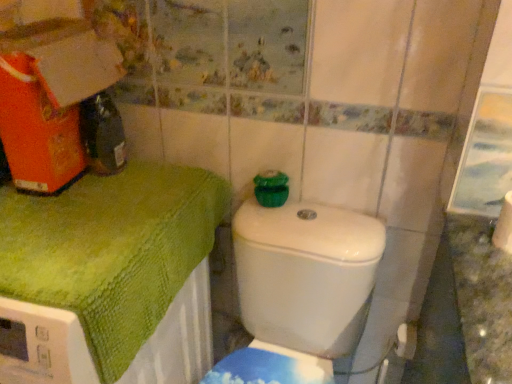
What is the approximate width of white glossy toilet at center?

25.74 inches.

Locate an element on the screen. Image resolution: width=512 pixels, height=384 pixels. white glossy toilet at center is located at coordinates (305, 275).

Does point (279, 326) appear closer or farther from the camera than point (510, 224)?

Point (279, 326) is farther from the camera than point (510, 224).

How many degrees apart are the facing directions of white glossy toilet at center and white matte toilet paper at lower right, the second toilet paper from the back?

white glossy toilet at center and white matte toilet paper at lower right, the second toilet paper from the back, are facing 88.5 degrees away from each other.

Does white glossy toilet at center have a lesser height compared to white matte toilet paper at lower right, the 1th toilet paper from the top?

No, white glossy toilet at center is not shorter than white matte toilet paper at lower right, the 1th toilet paper from the top.

Are white glossy toilet at center and white matte toilet paper at lower right, marked as the second toilet paper in a bottom-to-top arrangement, making contact?

No, white glossy toilet at center is not beside white matte toilet paper at lower right, marked as the second toilet paper in a bottom-to-top arrangement.

From the image's perspective, is white matte toilet paper at lower right, which is the 1th toilet paper in back-to-front order, above or below green textured towel at upper left?

white matte toilet paper at lower right, which is the 1th toilet paper in back-to-front order, is below green textured towel at upper left.

Considering the sizes of objects white matte toilet paper at lower right, which is the 1th toilet paper in back-to-front order, and green textured towel at upper left in the image provided, who is smaller, white matte toilet paper at lower right, which is the 1th toilet paper in back-to-front order, or green textured towel at upper left?

white matte toilet paper at lower right, which is the 1th toilet paper in back-to-front order.

Based on the photo, how many degrees apart are the facing directions of white matte toilet paper at lower right, which is the 1th toilet paper in back-to-front order, and green textured towel at upper left?

The angle between the facing direction of white matte toilet paper at lower right, which is the 1th toilet paper in back-to-front order, and the facing direction of green textured towel at upper left is 3.38 degrees.

Which object is further away from the camera, white matte toilet paper at lower right, which ranks as the second toilet paper in top-to-bottom order, or green textured towel at upper left?

white matte toilet paper at lower right, which ranks as the second toilet paper in top-to-bottom order, is behind.

Based on their sizes in the image, would you say green textured towel at upper left is bigger or smaller than white glossy toilet at center?

Considering their sizes, green textured towel at upper left takes up more space than white glossy toilet at center.

Is green textured towel at upper left located outside white glossy toilet at center?

Yes, green textured towel at upper left is located beyond the bounds of white glossy toilet at center.

Does green textured towel at upper left appear on the left side of white glossy toilet at center?

Yes, green textured towel at upper left is to the left of white glossy toilet at center.

Is the surface of green textured towel at upper left in direct contact with white glossy toilet at center?

No, green textured towel at upper left is not beside white glossy toilet at center.

From the image's perspective, is white glossy toilet at center positioned above or below white matte toilet paper at lower right, placed as the 1th toilet paper when sorted from bottom to top?

From the image's perspective, white glossy toilet at center appears below white matte toilet paper at lower right, placed as the 1th toilet paper when sorted from bottom to top.

From a real-world perspective, is white glossy toilet at center above or below white matte toilet paper at lower right, which is the 1th toilet paper in back-to-front order?

white glossy toilet at center is above white matte toilet paper at lower right, which is the 1th toilet paper in back-to-front order.

Is white glossy toilet at center taller than white matte toilet paper at lower right, which ranks as the second toilet paper in top-to-bottom order?

Indeed, white glossy toilet at center has a greater height compared to white matte toilet paper at lower right, which ranks as the second toilet paper in top-to-bottom order.

Is green textured towel at upper left thinner than white matte toilet paper at lower right, which is the 1th toilet paper in back-to-front order?

No.

From the image's perspective, is green textured towel at upper left positioned above or below white matte toilet paper at lower right, placed as the 1th toilet paper when sorted from bottom to top?

Clearly, from the image's perspective, green textured towel at upper left is above white matte toilet paper at lower right, placed as the 1th toilet paper when sorted from bottom to top.

Is green textured towel at upper left not inside white matte toilet paper at lower right, marked as the second toilet paper in a front-to-back arrangement?

green textured towel at upper left is positioned outside white matte toilet paper at lower right, marked as the second toilet paper in a front-to-back arrangement.

Is green textured towel at upper left directly adjacent to white matte toilet paper at lower right, marked as the second toilet paper in a front-to-back arrangement?

green textured towel at upper left is not next to white matte toilet paper at lower right, marked as the second toilet paper in a front-to-back arrangement, and they're not touching.

Is white matte toilet paper at lower right, the 1th toilet paper positioned from the front, positioned before white glossy toilet at center?

No, it is behind white glossy toilet at center.

Consider the image. Is there a large distance between white matte toilet paper at lower right, the 1th toilet paper from the top, and white glossy toilet at center?

No.

Can you tell me how much white matte toilet paper at lower right, the second toilet paper from the back, and white glossy toilet at center differ in facing direction?

There is a 88.5-degree angle between the facing directions of white matte toilet paper at lower right, the second toilet paper from the back, and white glossy toilet at center.

From the image's perspective, which is above, white matte toilet paper at lower right, the 1th toilet paper positioned from the front, or white glossy toilet at center?

white matte toilet paper at lower right, the 1th toilet paper positioned from the front, from the image's perspective.

Considering their positions, is white matte toilet paper at lower right, placed as the 1th toilet paper when sorted from bottom to top, located in front of or behind white matte toilet paper at lower right, the second toilet paper from the back?

Clearly, white matte toilet paper at lower right, placed as the 1th toilet paper when sorted from bottom to top, is behind white matte toilet paper at lower right, the second toilet paper from the back.

From a real-world perspective, is white matte toilet paper at lower right, marked as the second toilet paper in a front-to-back arrangement, positioned under white matte toilet paper at lower right, the 1th toilet paper from the top, based on gravity?

Correct, in the physical world, white matte toilet paper at lower right, marked as the second toilet paper in a front-to-back arrangement, is lower than white matte toilet paper at lower right, the 1th toilet paper from the top.

This screenshot has height=384, width=512. In order to click on toilet paper on the left of the white matte toilet paper at lower right, the 1th toilet paper from the top in this screenshot , I will do `click(406, 340)`.

In the image, is white matte toilet paper at lower right, placed as the 1th toilet paper when sorted from bottom to top, on the left side or the right side of white matte toilet paper at lower right, the second toilet paper from the back?

Clearly, white matte toilet paper at lower right, placed as the 1th toilet paper when sorted from bottom to top, is on the left of white matte toilet paper at lower right, the second toilet paper from the back, in the image.

Find the location of a particular element. toilet below the white matte toilet paper at lower right, the second toilet paper from the back (from the image's perspective) is located at coordinates (305, 275).

Locate an element on the screen. This screenshot has width=512, height=384. bath towel in front of the white matte toilet paper at lower right, which ranks as the second toilet paper in top-to-bottom order is located at coordinates (110, 278).

Looking at the image, which one is located closer to white glossy toilet at center, white matte toilet paper at lower right, which ranks as the second toilet paper in top-to-bottom order, or white matte toilet paper at lower right, marked as the second toilet paper in a bottom-to-top arrangement?

The object closer to white glossy toilet at center is white matte toilet paper at lower right, which ranks as the second toilet paper in top-to-bottom order.

Considering their positions, is white matte toilet paper at lower right, which is the 1th toilet paper in back-to-front order, positioned closer to white glossy toilet at center than green textured towel at upper left?

Among the two, green textured towel at upper left is located nearer to white glossy toilet at center.

Looking at the image, which one is located further to white glossy toilet at center, white matte toilet paper at lower right, the second toilet paper from the back, or green textured towel at upper left?

white matte toilet paper at lower right, the second toilet paper from the back, is positioned further to the anchor white glossy toilet at center.

Looking at the image, which one is located further to white matte toilet paper at lower right, which is the 1th toilet paper in back-to-front order, green textured towel at upper left or white glossy toilet at center?

Among the two, green textured towel at upper left is located further to white matte toilet paper at lower right, which is the 1th toilet paper in back-to-front order.

Based on their spatial positions, is white glossy toilet at center or green textured towel at upper left further from white matte toilet paper at lower right, which ranks as the second toilet paper in top-to-bottom order?

green textured towel at upper left lies further to white matte toilet paper at lower right, which ranks as the second toilet paper in top-to-bottom order, than the other object.

Estimate the real-world distances between objects in this image. Which object is further from white glossy toilet at center, white matte toilet paper at lower right, the 1th toilet paper positioned from the front, or white matte toilet paper at lower right, which is the 1th toilet paper in back-to-front order?

white matte toilet paper at lower right, the 1th toilet paper positioned from the front, is further to white glossy toilet at center.

When comparing their distances from white glossy toilet at center, does green textured towel at upper left or white matte toilet paper at lower right, the second toilet paper from the back, seem further?

Based on the image, white matte toilet paper at lower right, the second toilet paper from the back, appears to be further to white glossy toilet at center.

Which object lies nearer to the anchor point green textured towel at upper left, white matte toilet paper at lower right, the 1th toilet paper from the top, or white matte toilet paper at lower right, placed as the 1th toilet paper when sorted from bottom to top?

white matte toilet paper at lower right, the 1th toilet paper from the top, lies closer to green textured towel at upper left than the other object.

The image size is (512, 384). What are the coordinates of `toilet between green textured towel at upper left and white matte toilet paper at lower right, placed as the 1th toilet paper when sorted from bottom to top` in the screenshot? It's located at (305, 275).

What are the coordinates of `toilet paper located between white glossy toilet at center and white matte toilet paper at lower right, marked as the second toilet paper in a front-to-back arrangement, in the depth direction` in the screenshot? It's located at (504, 226).

Where is `toilet paper situated between green textured towel at upper left and white matte toilet paper at lower right, marked as the second toilet paper in a bottom-to-top arrangement, from left to right`? The width and height of the screenshot is (512, 384). toilet paper situated between green textured towel at upper left and white matte toilet paper at lower right, marked as the second toilet paper in a bottom-to-top arrangement, from left to right is located at coordinates (406, 340).

Identify the location of toilet between green textured towel at upper left and white matte toilet paper at lower right, marked as the second toilet paper in a bottom-to-top arrangement, from left to right. The height and width of the screenshot is (384, 512). (305, 275).